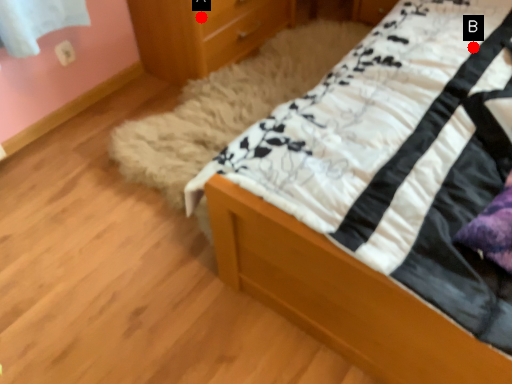
Question: Two points are circled on the image, labeled by A and B beside each circle. Which of the following is the farthest from the observer?

Choices:
 (A) A is further
 (B) B is further

Answer: (A)